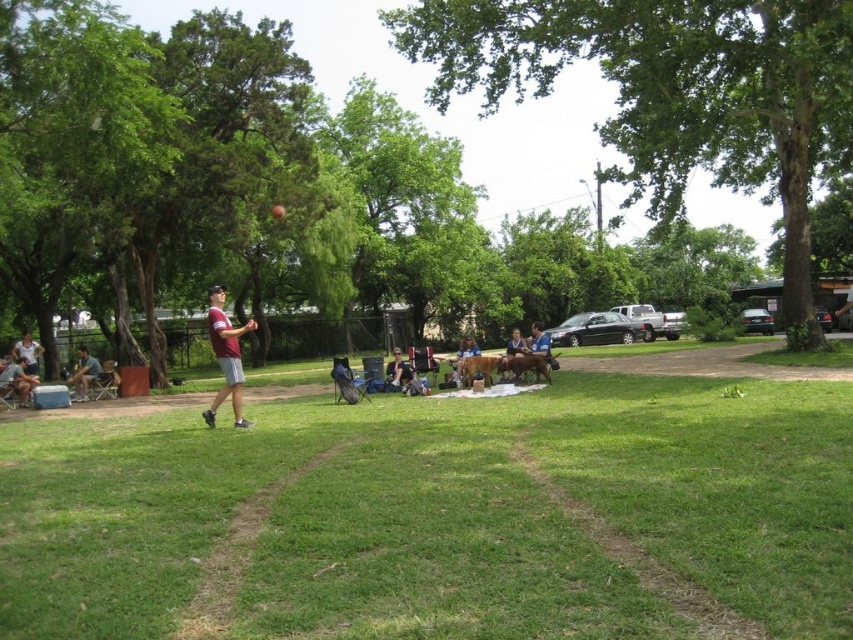
Which is more to the left, matte gray shorts at lower left or matte gray shorts at left?

matte gray shorts at left

Is point (4, 385) farther from viewer compared to point (86, 385)?

No, it is not.

Between point (15, 387) and point (94, 365), which one is positioned in front?

Point (15, 387)

Find the location of `matte gray shorts at lower left`. matte gray shorts at lower left is located at coordinates (15, 380).

Is maroon jersey at center positioned before matte gray shorts at left?

Yes, it is in front of matte gray shorts at left.

Does point (216, 404) lie behind point (96, 358)?

No, (216, 404) is in front of (96, 358).

Which is in front, point (231, 406) or point (77, 387)?

Point (231, 406) is more forward.

Identify the location of maroon jersey at center. The image size is (853, 640). (225, 356).

Who is taller, matte gray shorts at lower left or blue fabric chair at center?

blue fabric chair at center

Who is more forward, (9, 380) or (508, 369)?

Point (508, 369)

Who is more distant from viewer, (4, 368) or (509, 358)?

Point (4, 368)

At what (x,y) coordinates should I click in order to perform the action: click on matte gray shorts at lower left. Please return your answer as a coordinate pair (x, y). Looking at the image, I should click on (15, 380).